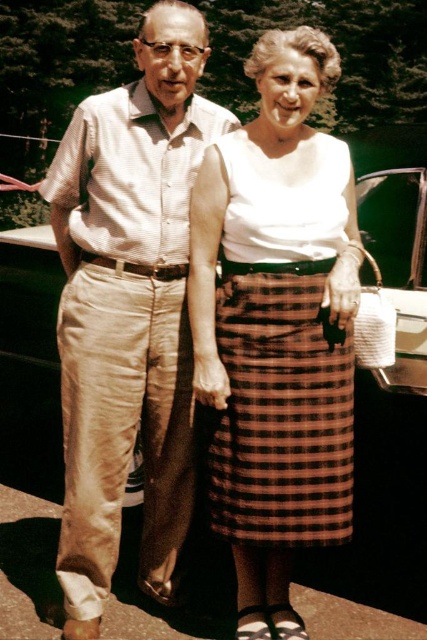
Does light beige cotton pants at left appear under brown plaid skirt at center?

No, light beige cotton pants at left is not below brown plaid skirt at center.

In order to click on light beige cotton pants at left in this screenshot , I will do `click(128, 308)`.

What do you see at coordinates (128, 308) in the screenshot?
I see `light beige cotton pants at left` at bounding box center [128, 308].

Identify the location of light beige cotton pants at left. This screenshot has height=640, width=427. (128, 308).